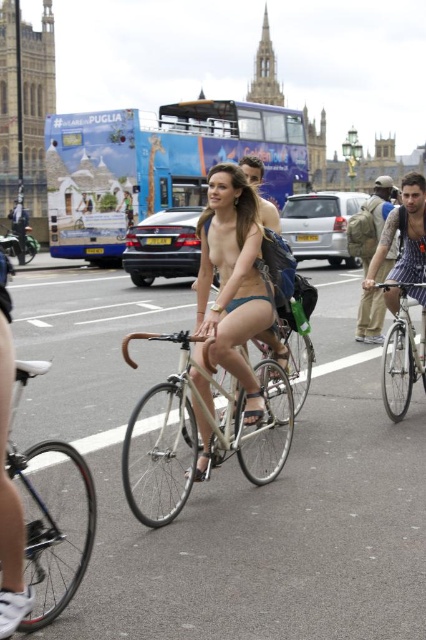
You are a photographer standing on the sidewalk observing the scene. You want to capture a photo where the matte skin nude at center and the silver metallic bicycle at center are both clearly visible. Based on their positions, which object should you frame first to ensure both are in the shot?

The matte skin nude at center is positioned on the right side of the silver metallic bicycle at center. To ensure both are in the shot, you should frame the silver metallic bicycle at center first since it is on the left, allowing the matte skin nude at center to naturally fall into the frame on its right side.